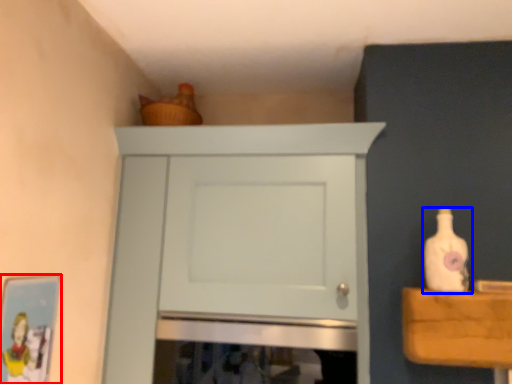
Question: Which object is closer to the camera taking this photo, picture frame (highlighted by a red box) or bottle (highlighted by a blue box)?

Choices:
 (A) picture frame
 (B) bottle

Answer: (A)